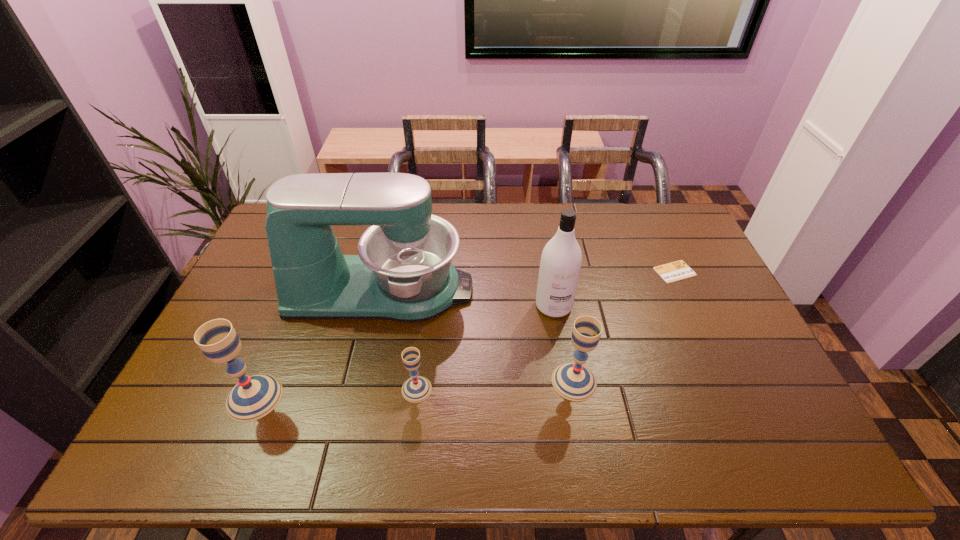
This screenshot has width=960, height=540. I want to click on free space for a new chalice on the right, so click(x=727, y=374).